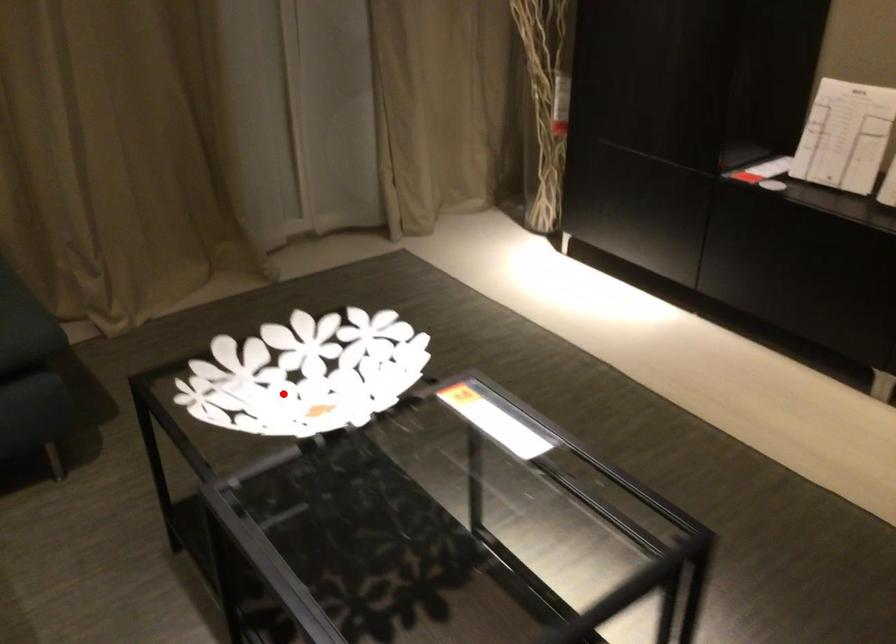
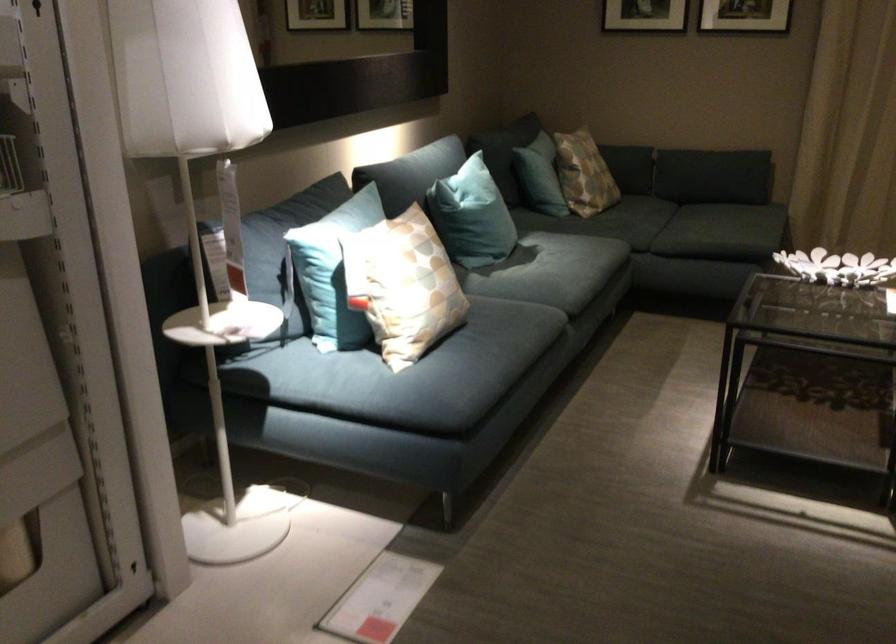
Where in the second image is the point corresponding to the highlighted location from the first image?

(837, 267)